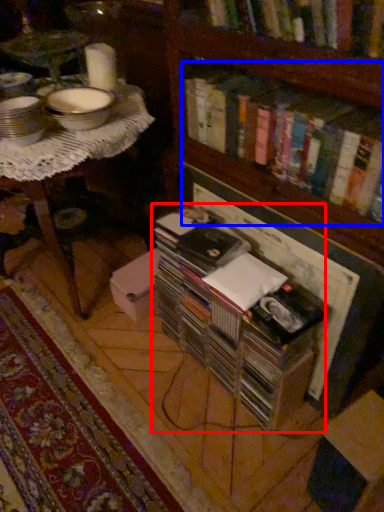
Question: Which object is closer to the camera taking this photo, book (highlighted by a red box) or book (highlighted by a blue box)?

Choices:
 (A) book
 (B) book

Answer: (B)